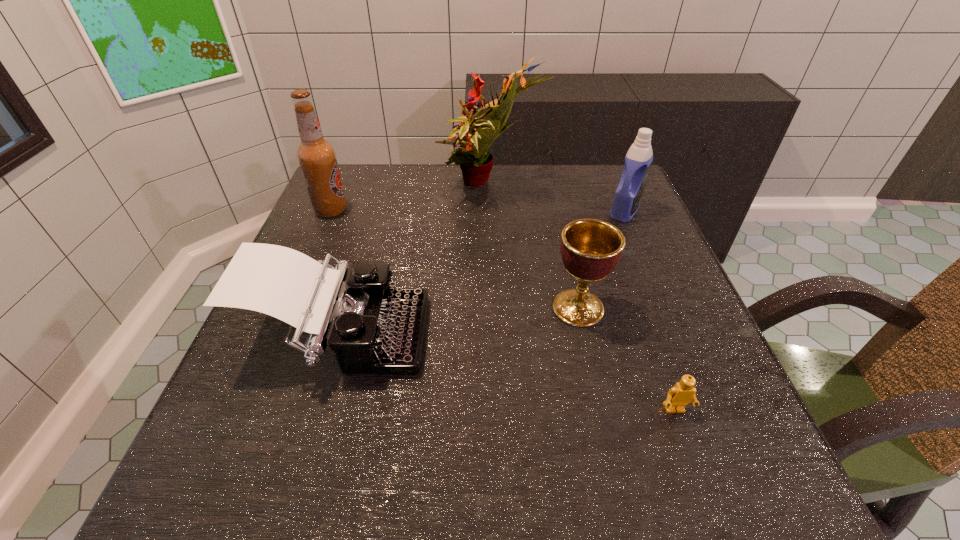
Where is `detergent located at the right edge`? detergent located at the right edge is located at coordinates (637, 163).

Locate an element on the screen. The image size is (960, 540). Lego positioned at the right edge is located at coordinates (678, 397).

Locate an element on the screen. The image size is (960, 540). object that is at the far left corner is located at coordinates (317, 157).

In order to click on object that is positioned at the far right corner in this screenshot , I will do `click(637, 163)`.

In the image, there is a desktop. Where is `free space at the far edge`? free space at the far edge is located at coordinates (456, 199).

In the image, there is a desktop. At what (x,y) coordinates should I click in order to perform the action: click on vacant space at the near edge. Please return your answer as a coordinate pair (x, y). The width and height of the screenshot is (960, 540). Looking at the image, I should click on (318, 467).

The height and width of the screenshot is (540, 960). I want to click on blank space at the left edge, so click(x=224, y=437).

Where is `vacant space at the right edge of the desktop`? Image resolution: width=960 pixels, height=540 pixels. vacant space at the right edge of the desktop is located at coordinates (587, 213).

In the image, there is a desktop. Identify the location of vacant region at the far left corner. (373, 201).

You are a GUI agent. You are given a task and a screenshot of the screen. Output one action in this format:
    pyautogui.click(x=<x>, y=<y>)
    Task: Click on the empty location between the typewriter and the bouquet
    This screenshot has width=960, height=540.
    Given the screenshot: What is the action you would take?
    pyautogui.click(x=415, y=262)